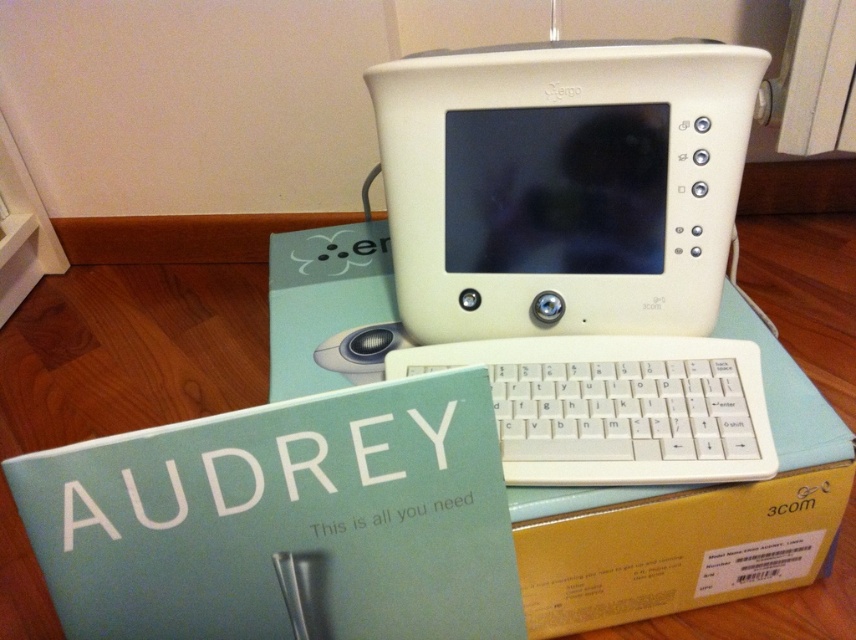
Question: Considering the real-world distances, which object is farthest from the matte white book at center?

Choices:
 (A) white plastic monitor at upper center
 (B) white plastic keyboard at center
 (C) cardboard box at center
 (D) white plastic mouse at center

Answer: (A)

Question: Can you confirm if white plastic keyboard at center is positioned below white plastic mouse at center?

Choices:
 (A) no
 (B) yes

Answer: (B)

Question: Is white plastic keyboard at center wider than white plastic mouse at center?

Choices:
 (A) yes
 (B) no

Answer: (A)

Question: Estimate the real-world distances between objects in this image. Which object is closer to the matte white book at center?

Choices:
 (A) white plastic keyboard at center
 (B) white plastic monitor at upper center

Answer: (A)

Question: Which object is positioned farthest from the white plastic keyboard at center?

Choices:
 (A) white plastic mouse at center
 (B) cardboard box at center
 (C) matte white book at center
 (D) white plastic monitor at upper center

Answer: (A)

Question: Can you confirm if matte white book at center is positioned to the left of cardboard box at center?

Choices:
 (A) no
 (B) yes

Answer: (B)